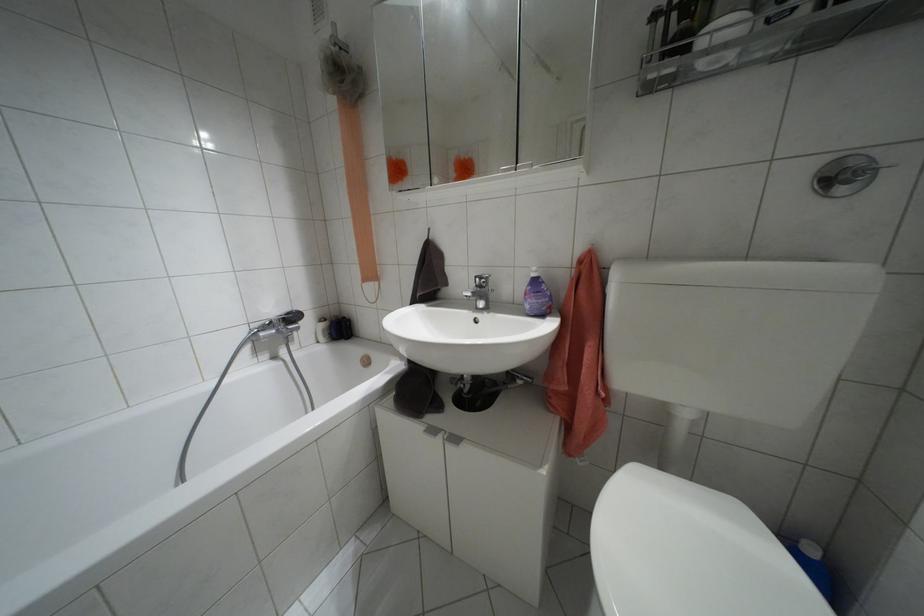
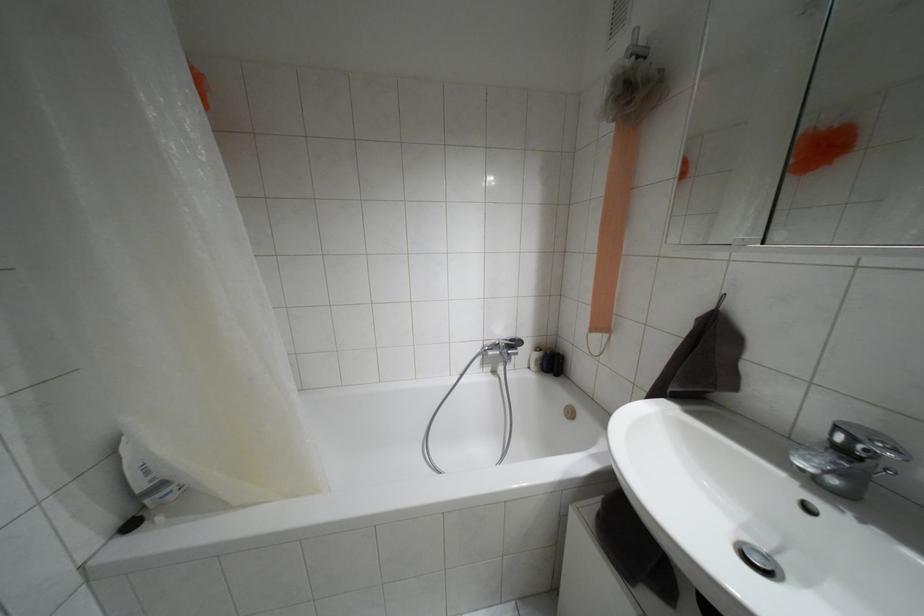
Question: Based on the continuous images, in which direction is the camera rotating? Reply with the corresponding letter.

Choices:
 (A) Left
 (B) Right
 (C) Up
 (D) Down

Answer: (A)